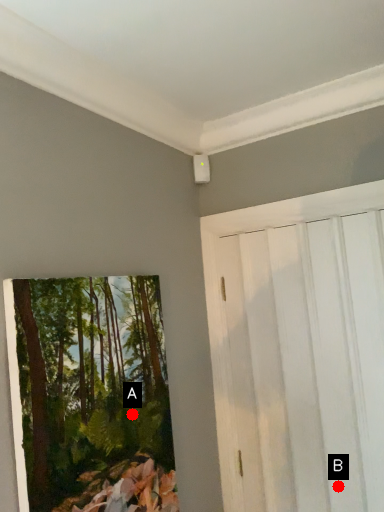
Question: Two points are circled on the image, labeled by A and B beside each circle. Among these points, which one is farthest from the camera?

Choices:
 (A) A is further
 (B) B is further

Answer: (B)